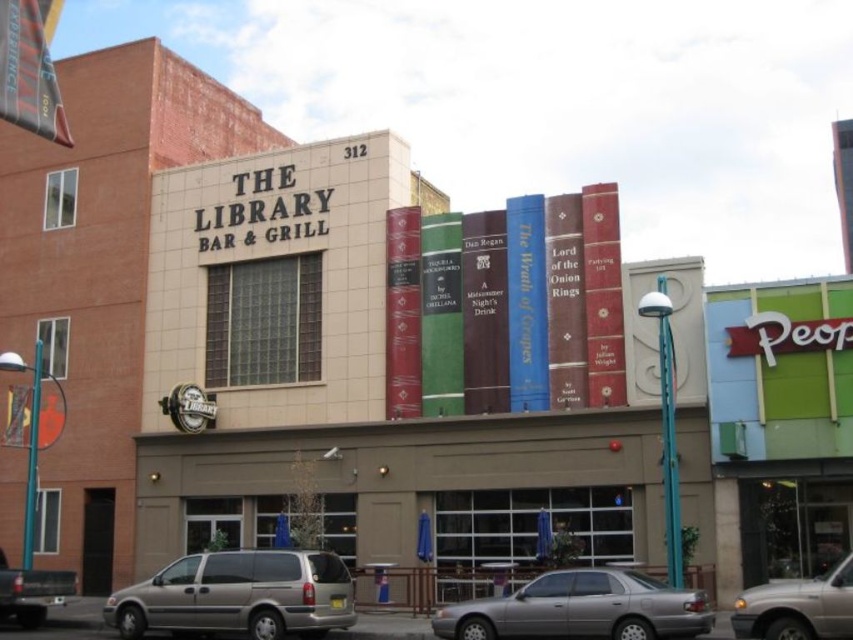
In the scene shown: Does metallic silver van at lower right have a lesser height compared to matte silver van at lower left?

No.

Who is higher up, metallic silver van at lower right or matte silver van at lower left?

Positioned higher is metallic silver van at lower right.

Describe the element at coordinates (798, 608) in the screenshot. I see `metallic silver van at lower right` at that location.

You are a GUI agent. You are given a task and a screenshot of the screen. Output one action in this format:
    pyautogui.click(x=<x>, y=<y>)
    Task: Click on the metallic silver van at lower right
    The height and width of the screenshot is (640, 853).
    Given the screenshot: What is the action you would take?
    pyautogui.click(x=798, y=608)

Which is behind, point (601, 636) or point (24, 618)?

Point (24, 618)

Does point (637, 621) come in front of point (9, 595)?

That is True.

This screenshot has height=640, width=853. In order to click on silver metallic sedan at lower center in this screenshot , I will do `click(579, 609)`.

Between gold metallic minivan at lower center and silver metallic sedan at lower center, which one appears on the right side from the viewer's perspective?

From the viewer's perspective, silver metallic sedan at lower center appears more on the right side.

What do you see at coordinates (238, 595) in the screenshot? The image size is (853, 640). I see `gold metallic minivan at lower center` at bounding box center [238, 595].

This screenshot has width=853, height=640. Find the location of `gold metallic minivan at lower center`. gold metallic minivan at lower center is located at coordinates (238, 595).